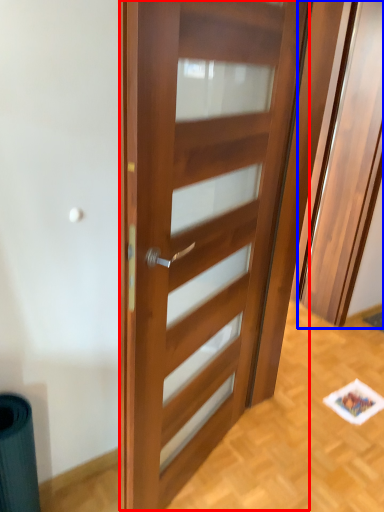
Question: Which object is further to the camera taking this photo, door (highlighted by a red box) or elevator (highlighted by a blue box)?

Choices:
 (A) door
 (B) elevator

Answer: (B)